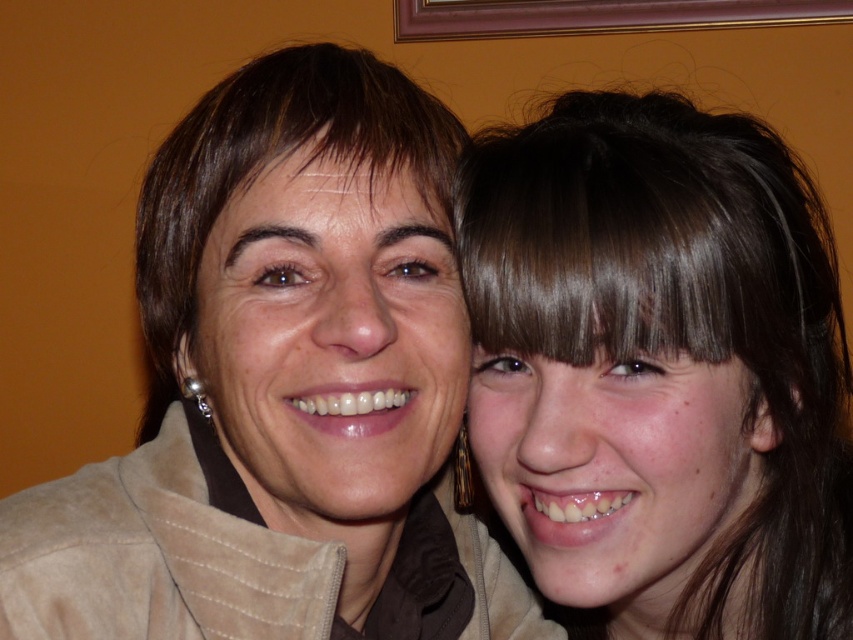
You are a photographer who wants to focus on the suede jacket at center. Given its position coordinates, can you determine if it is located in the central area of the image?

The suede jacket at center is positioned at coordinates point (x=283, y=388), which is slightly to the right and above the exact center of the image. However, since it is labeled as being at the center, it is considered to be in the central area of the image.

You are a tailor measuring the suede jacket at center for alterations. The minimum distance required for the tailor to work comfortably is 50 centimeters. Can you proceed with the alterations now?

The suede jacket at center is only 44.99 centimeters away from the viewer, which is less than the required 50 centimeters. Therefore, the tailor cannot proceed with the alterations at this distance.

You are taking a photo of two people in the scene. You want to focus on the point that is closer to you. Which point should you choose between point (171, 182) and point (807, 312)?

You should choose point (171, 182) because it is closer to the camera than point (807, 312).